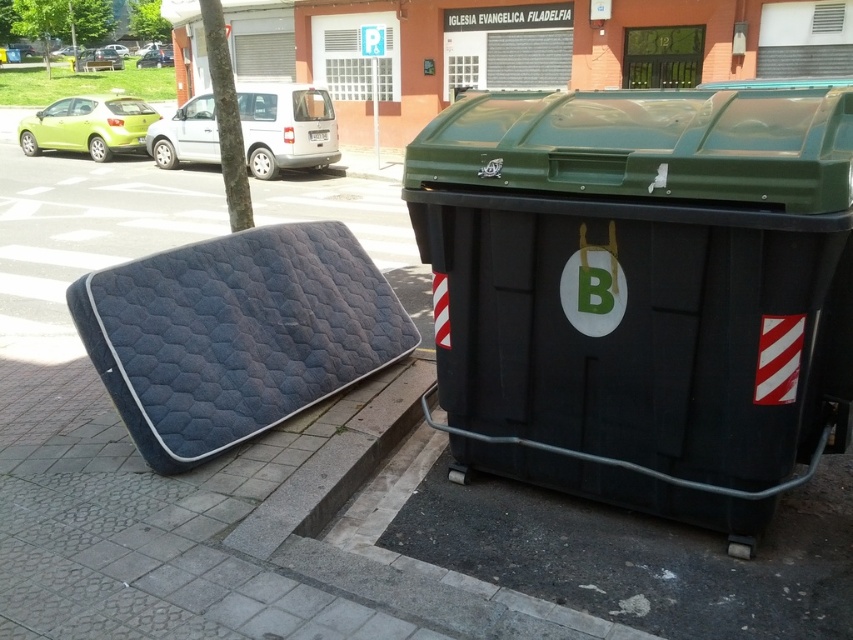
Which of these two, black plastic recycling bin at center or dark blue quilted mattress at lower left, stands shorter?

With less height is dark blue quilted mattress at lower left.

Is point (694, 225) closer to viewer compared to point (160, 337)?

Yes, it is in front of point (160, 337).

Image resolution: width=853 pixels, height=640 pixels. Identify the location of black plastic recycling bin at center. (643, 291).

Who is taller, dark blue quilted mattress at lower left or silver metallic van at center?

silver metallic van at center is taller.

Does dark blue quilted mattress at lower left have a larger size compared to silver metallic van at center?

No.

Which is behind, point (368, 285) or point (265, 177)?

Positioned behind is point (265, 177).

Where is `dark blue quilted mattress at lower left`? This screenshot has width=853, height=640. dark blue quilted mattress at lower left is located at coordinates (235, 333).

Does point (328, 339) come closer to viewer compared to point (120, 104)?

Yes, point (328, 339) is in front of point (120, 104).

Between dark blue quilted mattress at lower left and matte green car at upper left, which one has more height?

Standing taller between the two is matte green car at upper left.

Where is `dark blue quilted mattress at lower left`? The width and height of the screenshot is (853, 640). dark blue quilted mattress at lower left is located at coordinates (235, 333).

Identify the location of dark blue quilted mattress at lower left. The width and height of the screenshot is (853, 640). (235, 333).